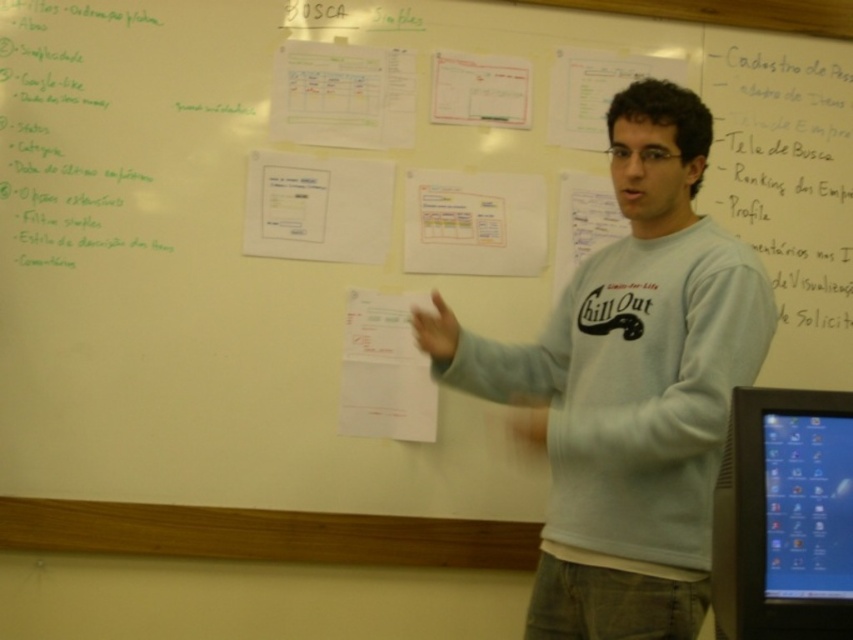
Identify the location of white cotton shirt at center. (630, 387).

Can you confirm if white cotton shirt at center is positioned below blue glossy monitor at right?

Incorrect, white cotton shirt at center is not positioned below blue glossy monitor at right.

You are a GUI agent. You are given a task and a screenshot of the screen. Output one action in this format:
    pyautogui.click(x=<x>, y=<y>)
    Task: Click on the white cotton shirt at center
    This screenshot has height=640, width=853.
    Given the screenshot: What is the action you would take?
    pyautogui.click(x=630, y=387)